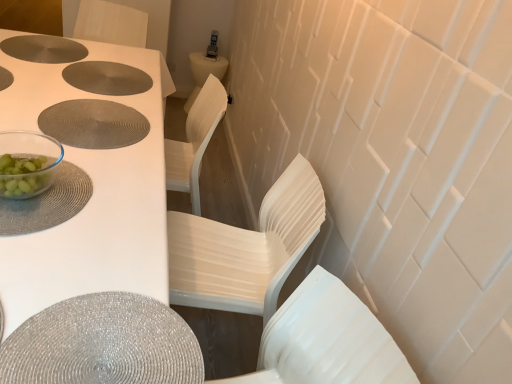
Where is `vacant area that lies between matte silver placemat at center, which ranks as the first hole in bottom-to-top order, and green glass bowl at upper left`? This screenshot has width=512, height=384. vacant area that lies between matte silver placemat at center, which ranks as the first hole in bottom-to-top order, and green glass bowl at upper left is located at coordinates (64, 153).